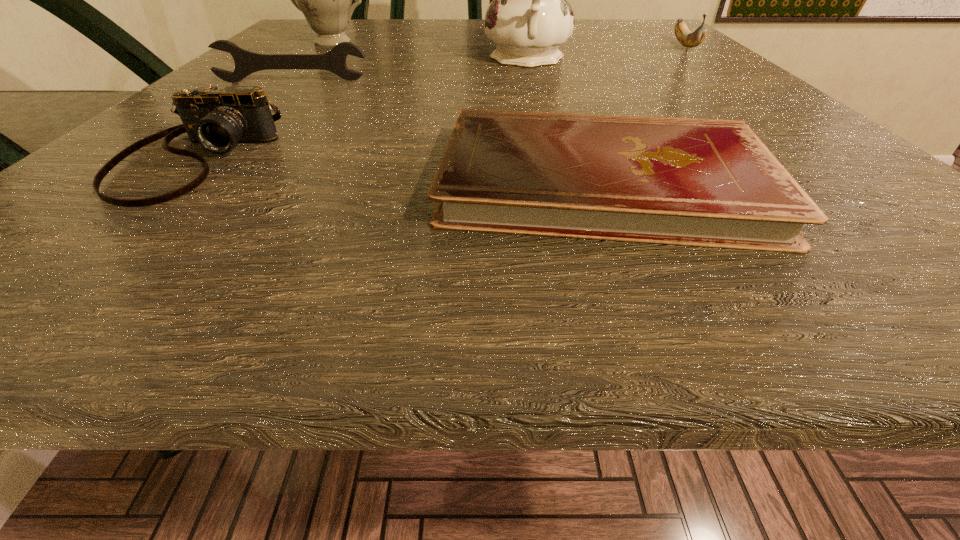
Where is `object located at the far left corner`? The height and width of the screenshot is (540, 960). object located at the far left corner is located at coordinates (325, 0).

The width and height of the screenshot is (960, 540). Find the location of `object that is at the far right corner`. object that is at the far right corner is located at coordinates (689, 39).

Identify the location of object that is at the near right corner. (713, 183).

In the image, there is a desktop. Where is `vacant space at the far edge`? This screenshot has width=960, height=540. vacant space at the far edge is located at coordinates (576, 41).

Image resolution: width=960 pixels, height=540 pixels. In order to click on vacant space at the near edge of the desktop in this screenshot , I will do `click(627, 274)`.

Where is `free space at the left edge`? free space at the left edge is located at coordinates (134, 140).

Find the location of `free region at the right edge of the desktop`. free region at the right edge of the desktop is located at coordinates (677, 87).

Where is `free location at the near left corner of the desktop`? free location at the near left corner of the desktop is located at coordinates (85, 223).

Where is `free space at the far right corner of the desktop`? free space at the far right corner of the desktop is located at coordinates (643, 45).

You are a GUI agent. You are given a task and a screenshot of the screen. Output one action in this format:
    pyautogui.click(x=<x>, y=<y>)
    Task: Click on the free location at the near right corner
    
    Given the screenshot: What is the action you would take?
    pyautogui.click(x=887, y=287)